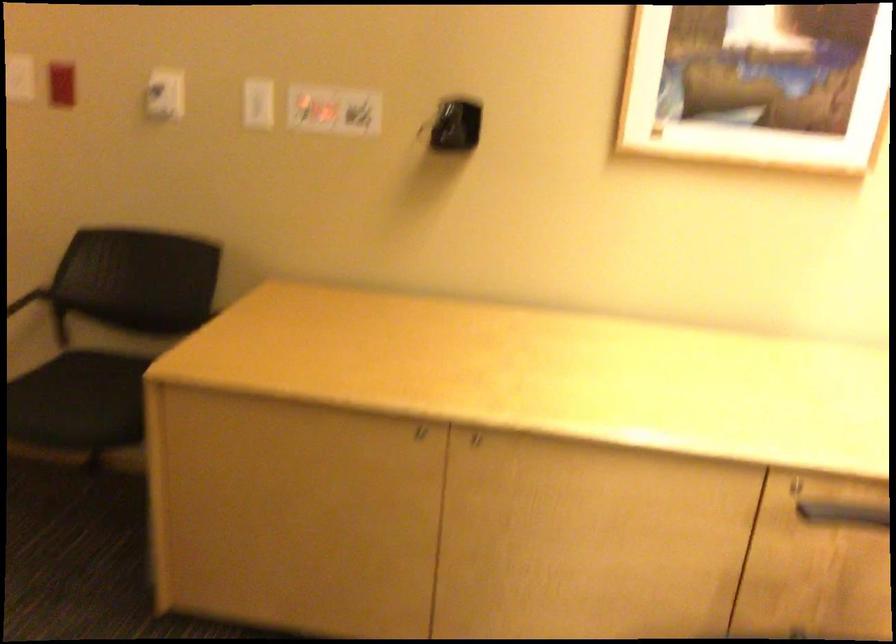
Find where to rest the black chair armrest. Please return your answer as a coordinate pair (x, y).

(143, 440)